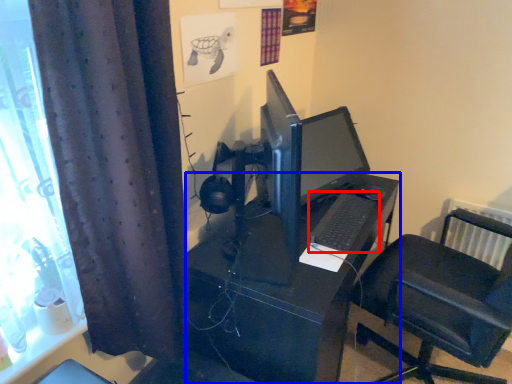
Question: Which object is closer to the camera taking this photo, computer keyboard (highlighted by a red box) or desk (highlighted by a blue box)?

Choices:
 (A) computer keyboard
 (B) desk

Answer: (B)